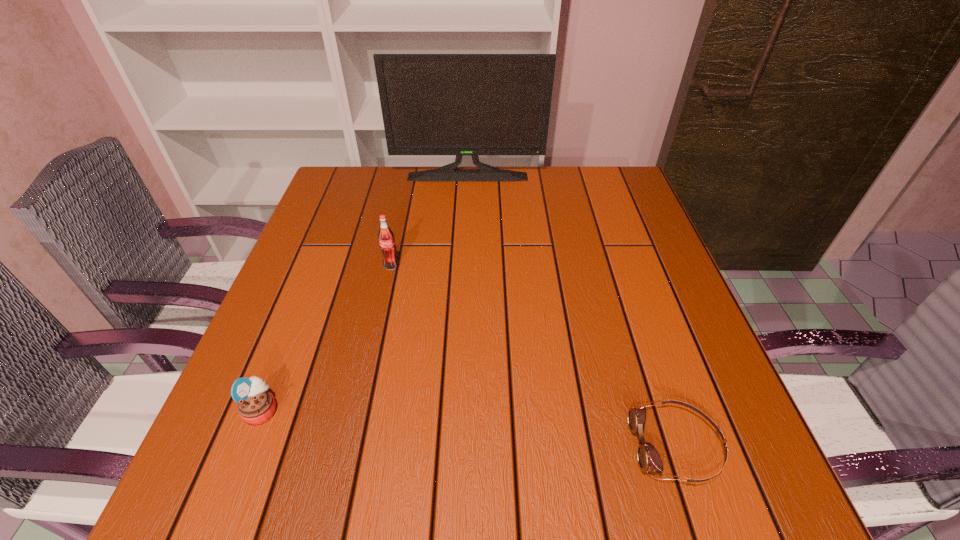
Identify the location of blank region between the monitor and the third shortest object. (429, 221).

Where is `empty location between the soda bottle and the tallest object`? The image size is (960, 540). empty location between the soda bottle and the tallest object is located at coordinates (429, 221).

You are a GUI agent. You are given a task and a screenshot of the screen. Output one action in this format:
    pyautogui.click(x=<x>, y=<y>)
    Task: Click on the vacant area between the second shortest object and the second farthest object
    Image resolution: width=960 pixels, height=540 pixels.
    Given the screenshot: What is the action you would take?
    pyautogui.click(x=326, y=338)

I want to click on unoccupied area between the rightmost object and the monitor, so click(x=572, y=311).

What are the coordinates of `vacant region between the rightmost object and the third tallest object` in the screenshot? It's located at (469, 428).

You are a GUI agent. You are given a task and a screenshot of the screen. Output one action in this format:
    pyautogui.click(x=<x>, y=<y>)
    Task: Click on the closest object to the monitor
    
    Given the screenshot: What is the action you would take?
    pyautogui.click(x=386, y=237)

Find the location of `the closest object to the third shortest object`. the closest object to the third shortest object is located at coordinates (256, 405).

I want to click on vacant space that satisfies the following two spatial constraints: 1. on the front-facing side of the farthest object; 2. on the front-facing side of the third tallest object, so click(459, 410).

The height and width of the screenshot is (540, 960). I want to click on free space that satisfies the following two spatial constraints: 1. on the label of the soda bottle; 2. on the front-facing side of the leftmost object, so click(361, 410).

This screenshot has width=960, height=540. What are the coordinates of `vacant area that satisfies the following two spatial constraints: 1. on the front-facing side of the tallest object; 2. on the front-facing side of the second shortest object` in the screenshot? It's located at (459, 410).